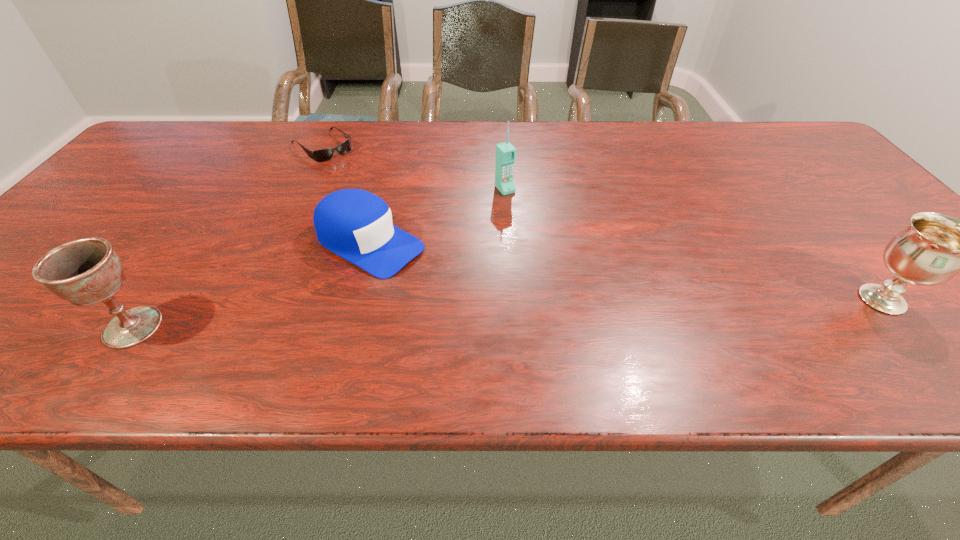
The width and height of the screenshot is (960, 540). Find the location of `object that is positioned at the right edge`. object that is positioned at the right edge is located at coordinates (934, 248).

Locate an element on the screen. object located at the near right corner is located at coordinates (934, 248).

I want to click on blank space at the far edge of the desktop, so click(538, 145).

In the image, there is a desktop. Where is `free space at the near edge`? The height and width of the screenshot is (540, 960). free space at the near edge is located at coordinates coord(670,300).

Locate an element on the screen. The width and height of the screenshot is (960, 540). vacant space at the left edge is located at coordinates 85,214.

This screenshot has height=540, width=960. I want to click on vacant space at the right edge of the desktop, so click(x=874, y=239).

The image size is (960, 540). In the image, there is a desktop. Identify the location of vacant space at the far left corner. (181, 125).

Locate an element on the screen. The height and width of the screenshot is (540, 960). vacant space at the near right corner is located at coordinates (935, 323).

You are a GUI agent. You are given a task and a screenshot of the screen. Output one action in this format:
    pyautogui.click(x=<x>, y=<y>)
    Task: Click on the free area in between the cellular telephone and the rightmost object
    
    Given the screenshot: What is the action you would take?
    pyautogui.click(x=693, y=244)

The height and width of the screenshot is (540, 960). What are the coordinates of `free space between the leftmost object and the cellular telephone` in the screenshot? It's located at (319, 258).